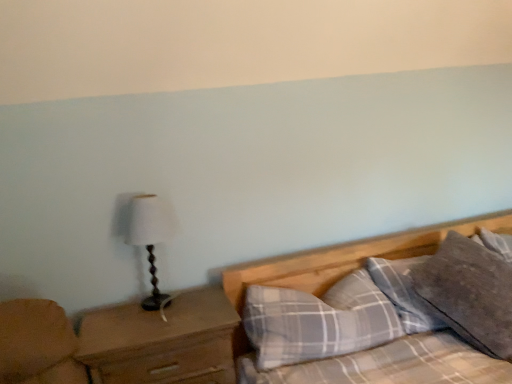
Question: Does brown wooden nightstand at left have a greater height compared to wooden table lamp at left?

Choices:
 (A) no
 (B) yes

Answer: (B)

Question: Can wooden table lamp at left be found inside brown wooden nightstand at left?

Choices:
 (A) yes
 (B) no

Answer: (B)

Question: Is brown wooden nightstand at left positioned with its back to wooden table lamp at left?

Choices:
 (A) yes
 (B) no

Answer: (B)

Question: Can you confirm if brown wooden nightstand at left is bigger than wooden table lamp at left?

Choices:
 (A) yes
 (B) no

Answer: (A)

Question: Is brown wooden nightstand at left to the right of wooden table lamp at left from the viewer's perspective?

Choices:
 (A) yes
 (B) no

Answer: (A)

Question: Is plaid fabric pillow at lower right, the 1th pillow viewed from the left, bigger or smaller than gray cotton pillow at upper right, the 2th pillow when ordered from left to right?

Choices:
 (A) big
 (B) small

Answer: (A)

Question: From the image's perspective, is plaid fabric pillow at lower right, the 1th pillow viewed from the left, located above or below gray cotton pillow at upper right, the 2th pillow when ordered from left to right?

Choices:
 (A) below
 (B) above

Answer: (A)

Question: Choose the correct answer: Is plaid fabric pillow at lower right, arranged as the 2th pillow when viewed from the right, inside gray cotton pillow at upper right, which is counted as the first pillow, starting from the right, or outside it?

Choices:
 (A) inside
 (B) outside

Answer: (B)

Question: Looking at their shapes, would you say plaid fabric pillow at lower right, arranged as the 2th pillow when viewed from the right, is wider or thinner than gray cotton pillow at upper right, the 2th pillow when ordered from left to right?

Choices:
 (A) wide
 (B) thin

Answer: (A)

Question: From a real-world perspective, relative to brown wooden nightstand at left, is wooden table lamp at left vertically above or below?

Choices:
 (A) below
 (B) above

Answer: (B)

Question: Is wooden table lamp at left situated inside brown wooden nightstand at left or outside?

Choices:
 (A) outside
 (B) inside

Answer: (A)

Question: Visually, is wooden table lamp at left positioned to the left or to the right of brown wooden nightstand at left?

Choices:
 (A) left
 (B) right

Answer: (A)

Question: Is wooden table lamp at left in front of or behind brown wooden nightstand at left in the image?

Choices:
 (A) behind
 (B) front

Answer: (A)

Question: In terms of width, does plaid fabric pillow at lower right, arranged as the 2th pillow when viewed from the right, look wider or thinner when compared to wooden table lamp at left?

Choices:
 (A) thin
 (B) wide

Answer: (B)

Question: Considering the positions of plaid fabric pillow at lower right, the 1th pillow viewed from the left, and wooden table lamp at left in the image, is plaid fabric pillow at lower right, the 1th pillow viewed from the left, taller or shorter than wooden table lamp at left?

Choices:
 (A) short
 (B) tall

Answer: (A)